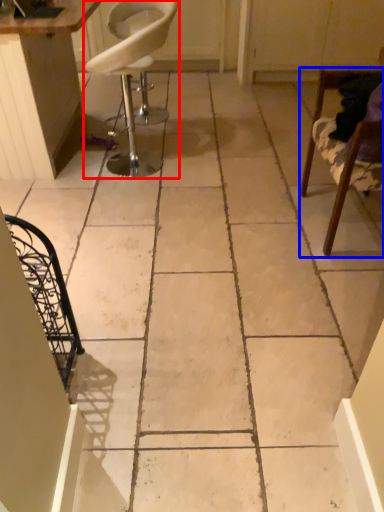
Question: Which of the following is the closest to the observer, chair (highlighted by a red box) or chair (highlighted by a blue box)?

Choices:
 (A) chair
 (B) chair

Answer: (B)